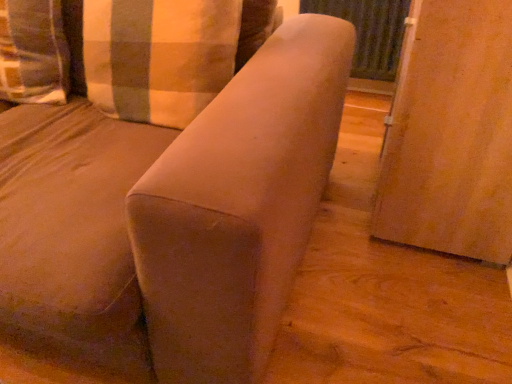
Question: Does wooden screen door at right, which is counted as the 2th screen door, starting from the back, have a greater height compared to suede-like beige sofa at center?

Choices:
 (A) yes
 (B) no

Answer: (B)

Question: Does wooden screen door at right, which is counted as the 1th screen door, starting from the front, have a lesser width compared to suede-like beige sofa at center?

Choices:
 (A) no
 (B) yes

Answer: (B)

Question: Is wooden screen door at right, which is counted as the 2th screen door, starting from the back, positioned beyond the bounds of suede-like beige sofa at center?

Choices:
 (A) yes
 (B) no

Answer: (A)

Question: Can suede-like beige sofa at center be found inside wooden screen door at right, which is counted as the 1th screen door, starting from the front?

Choices:
 (A) yes
 (B) no

Answer: (B)

Question: From the image's perspective, would you say wooden screen door at right, which is counted as the 2th screen door, starting from the back, is positioned over suede-like beige sofa at center?

Choices:
 (A) no
 (B) yes

Answer: (B)

Question: Which is correct: suede-like beige sofa at center is inside wooden screen door at right, which is counted as the 1th screen door, starting from the front, or outside of it?

Choices:
 (A) inside
 (B) outside

Answer: (B)

Question: Is suede-like beige sofa at center taller or shorter than wooden screen door at right, which is counted as the 1th screen door, starting from the front?

Choices:
 (A) tall
 (B) short

Answer: (A)

Question: From a real-world perspective, is suede-like beige sofa at center physically located above or below wooden screen door at right, which is counted as the 2th screen door, starting from the back?

Choices:
 (A) above
 (B) below

Answer: (A)

Question: Is point (175, 145) closer or farther from the camera than point (488, 122)?

Choices:
 (A) closer
 (B) farther

Answer: (A)

Question: From a real-world perspective, is plaid fabric pillow at upper left, the first pillow viewed from the right, positioned above or below wooden screen door at right, which is counted as the 1th screen door, starting from the front?

Choices:
 (A) below
 (B) above

Answer: (B)

Question: Visually, is plaid fabric pillow at upper left, the first pillow viewed from the right, positioned to the left or to the right of wooden screen door at right, which is counted as the 2th screen door, starting from the back?

Choices:
 (A) right
 (B) left

Answer: (B)

Question: In the image, is plaid fabric pillow at upper left, the second pillow in the left-to-right sequence, positioned in front of or behind wooden screen door at right, which is counted as the 1th screen door, starting from the front?

Choices:
 (A) behind
 (B) front

Answer: (A)

Question: From their relative heights in the image, would you say plaid fabric pillow at upper left, the second pillow in the left-to-right sequence, is taller or shorter than wooden screen door at right, which is counted as the 1th screen door, starting from the front?

Choices:
 (A) tall
 (B) short

Answer: (B)

Question: Is wooden screen door at right, which is counted as the 2th screen door, starting from the back, situated inside matte black radiator at upper right, which is counted as the second screen door, starting from the front, or outside?

Choices:
 (A) outside
 (B) inside

Answer: (A)

Question: Considering the positions of wooden screen door at right, which is counted as the 1th screen door, starting from the front, and matte black radiator at upper right, the first screen door viewed from the back, in the image, is wooden screen door at right, which is counted as the 1th screen door, starting from the front, taller or shorter than matte black radiator at upper right, the first screen door viewed from the back,?

Choices:
 (A) short
 (B) tall

Answer: (B)